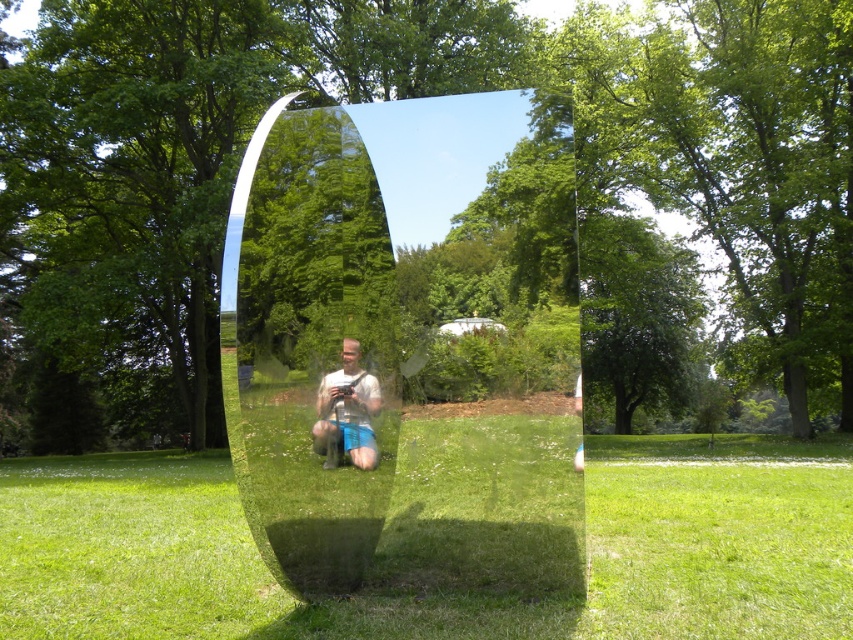
Question: Which of the following is the farthest from the observer?

Choices:
 (A) transparent glass sculpture at center
 (B) green grass at lower center
 (C) matte silver camera at center

Answer: (C)

Question: Does transparent glass sculpture at center appear under green grass at lower center?

Choices:
 (A) yes
 (B) no

Answer: (B)

Question: Is green grass at lower center positioned behind matte silver camera at center?

Choices:
 (A) no
 (B) yes

Answer: (A)

Question: Which point is farther from the camera taking this photo?

Choices:
 (A) (720, 540)
 (B) (334, 460)
 (C) (494, 160)

Answer: (A)

Question: Does transparent glass sculpture at center appear under matte silver camera at center?

Choices:
 (A) no
 (B) yes

Answer: (B)

Question: Which is nearer to the green grass at lower center?

Choices:
 (A) matte silver camera at center
 (B) transparent glass sculpture at center

Answer: (A)